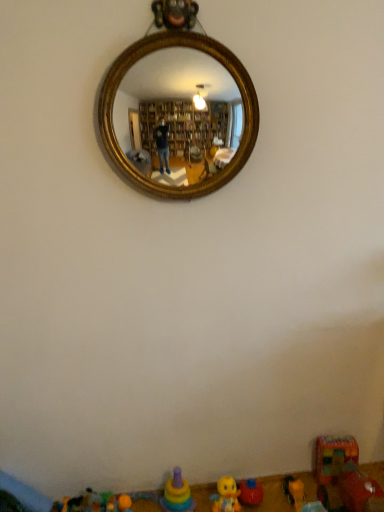
You are a GUI agent. You are given a task and a screenshot of the screen. Output one action in this format:
    pyautogui.click(x=<x>, y=<y>)
    Task: Click on the yellow plastic toy at lower right, which is the 6th toy from left to right
    
    Given the screenshot: What is the action you would take?
    pyautogui.click(x=294, y=490)

In order to face rubber duck at lower center, the seventh toy from the right, should I rotate leftwards or rightwards?

Turn left by 13.788 degrees to look at rubber duck at lower center, the seventh toy from the right.

Where is `yellow rubber duck at lower center, which is the fourth toy in right-to-left order`? The image size is (384, 512). yellow rubber duck at lower center, which is the fourth toy in right-to-left order is located at coordinates (226, 496).

What do you see at coordinates (177, 494) in the screenshot? This screenshot has width=384, height=512. I see `multicolored plastic stacking rings at lower center, acting as the 3th toy starting from the left` at bounding box center [177, 494].

Measure the distance between gold/gilded mirror at upper center and camera.

gold/gilded mirror at upper center and camera are 3.27 meters apart.

Find the location of a particular element. The width and height of the screenshot is (384, 512). yellow plastic toy at lower right, which is the 6th toy from left to right is located at coordinates (294, 490).

What are the coordinates of `toy that is the 1st one when counting rightward from the rubber duck at lower center, the seventh toy from the right` in the screenshot? It's located at (124, 503).

Based on the photo, are rubber duck at lower center, the 1th toy from the left, and orange rubber ball at lower center, the 6th toy in the right-to-left sequence, beside each other?

No, rubber duck at lower center, the 1th toy from the left, is not touching orange rubber ball at lower center, the 6th toy in the right-to-left sequence.

Which object is closer to the camera, rubber duck at lower center, the 1th toy from the left, or orange rubber ball at lower center, the 6th toy in the right-to-left sequence?

rubber duck at lower center, the 1th toy from the left, is in front.

Is rubber duck at lower center, the 1th toy from the left, outside of orange rubber ball at lower center, the 6th toy in the right-to-left sequence?

rubber duck at lower center, the 1th toy from the left, lies outside orange rubber ball at lower center, the 6th toy in the right-to-left sequence,'s area.

Is rubber duck at lower center, which is the third toy from right to left, situated inside rubber duck at lower center, the 1th toy from the left, or outside?

rubber duck at lower center, which is the third toy from right to left, is spatially situated outside rubber duck at lower center, the 1th toy from the left.

Which is in front, rubber duck at lower center, which is the third toy from right to left, or rubber duck at lower center, the seventh toy from the right?

Positioned in front is rubber duck at lower center, which is the third toy from right to left.

Does rubber duck at lower center, which is the third toy from right to left, have a greater height compared to rubber duck at lower center, the 1th toy from the left?

No, rubber duck at lower center, which is the third toy from right to left, is not taller than rubber duck at lower center, the 1th toy from the left.

This screenshot has height=512, width=384. In order to click on toy located on the left of orange rubber ball at lower center, the 2th toy in the left-to-right sequence in this screenshot , I will do `click(76, 503)`.

Is orange rubber ball at lower center, the 2th toy in the left-to-right sequence, positioned with its back to rubber duck at lower center, the 1th toy from the left?

No.

Is orange rubber ball at lower center, the 6th toy in the right-to-left sequence, not close to rubber duck at lower center, the 1th toy from the left?

No, there isn't a large distance between orange rubber ball at lower center, the 6th toy in the right-to-left sequence, and rubber duck at lower center, the 1th toy from the left.

From a real-world perspective, which is physically above, orange rubber ball at lower center, the 2th toy in the left-to-right sequence, or rubber duck at lower center, the seventh toy from the right?

orange rubber ball at lower center, the 2th toy in the left-to-right sequence.

Considering the relative positions of orange rubber ball at lower center, the 6th toy in the right-to-left sequence, and yellow plastic toy at lower right, which is the 6th toy from left to right, in the image provided, is orange rubber ball at lower center, the 6th toy in the right-to-left sequence, in front of yellow plastic toy at lower right, which is the 6th toy from left to right,?

No, the depth of orange rubber ball at lower center, the 6th toy in the right-to-left sequence, is greater than that of yellow plastic toy at lower right, which is the 6th toy from left to right.

Is orange rubber ball at lower center, the 2th toy in the left-to-right sequence, aimed at yellow plastic toy at lower right, which is the 6th toy from left to right?

No, orange rubber ball at lower center, the 2th toy in the left-to-right sequence, is not oriented towards yellow plastic toy at lower right, which is the 6th toy from left to right.

Is yellow plastic toy at lower right, which is the 6th toy from left to right, located within orange rubber ball at lower center, the 2th toy in the left-to-right sequence?

No, yellow plastic toy at lower right, which is the 6th toy from left to right, is not a part of orange rubber ball at lower center, the 2th toy in the left-to-right sequence.

Are orange rubber ball at lower center, the 6th toy in the right-to-left sequence, and yellow plastic toy at lower right, which is the 6th toy from left to right, far apart?

orange rubber ball at lower center, the 6th toy in the right-to-left sequence, is actually quite close to yellow plastic toy at lower right, which is the 6th toy from left to right.

Could yellow rubber duck at lower center, which is the fourth toy in right-to-left order, be considered to be inside multicolored plastic stacking rings at lower center, acting as the 5th toy starting from the right?

No, yellow rubber duck at lower center, which is the fourth toy in right-to-left order, is located outside of multicolored plastic stacking rings at lower center, acting as the 5th toy starting from the right.

Can you confirm if multicolored plastic stacking rings at lower center, acting as the 3th toy starting from the left, is thinner than yellow rubber duck at lower center, which is the fourth toy in right-to-left order?

Incorrect, the width of multicolored plastic stacking rings at lower center, acting as the 3th toy starting from the left, is not less than that of yellow rubber duck at lower center, which is the fourth toy in right-to-left order.

Between multicolored plastic stacking rings at lower center, acting as the 3th toy starting from the left, and yellow rubber duck at lower center, the 4th toy viewed from the left, which one appears on the right side from the viewer's perspective?

yellow rubber duck at lower center, the 4th toy viewed from the left.

Does multicolored plastic stacking rings at lower center, acting as the 3th toy starting from the left, have a larger size compared to yellow rubber duck at lower center, which is the fourth toy in right-to-left order?

Correct, multicolored plastic stacking rings at lower center, acting as the 3th toy starting from the left, is larger in size than yellow rubber duck at lower center, which is the fourth toy in right-to-left order.

From a real-world perspective, is orange rubber ball at lower center, the 6th toy in the right-to-left sequence, beneath plastic multicolored car at lower right, which is the first toy from right to left?

Yes, from a real-world perspective, orange rubber ball at lower center, the 6th toy in the right-to-left sequence, is beneath plastic multicolored car at lower right, which is the first toy from right to left.

Is orange rubber ball at lower center, the 2th toy in the left-to-right sequence, spatially inside plastic multicolored car at lower right, which appears as the seventh toy when viewed from the left, or outside of it?

orange rubber ball at lower center, the 2th toy in the left-to-right sequence, is not inside plastic multicolored car at lower right, which appears as the seventh toy when viewed from the left, it's outside.

Between orange rubber ball at lower center, the 6th toy in the right-to-left sequence, and plastic multicolored car at lower right, which is the first toy from right to left, which one has larger width?

plastic multicolored car at lower right, which is the first toy from right to left.

Is orange rubber ball at lower center, the 2th toy in the left-to-right sequence, far away from plastic multicolored car at lower right, which is the first toy from right to left?

No, orange rubber ball at lower center, the 2th toy in the left-to-right sequence, is not far from plastic multicolored car at lower right, which is the first toy from right to left.

Find the location of a particular element. The image size is (384, 512). toy that is the 6th one when counting downward from the gold/gilded mirror at upper center (from the image's perspective) is located at coordinates (352, 476).

Is point (231, 117) closer to camera compared to point (192, 503)?

No, it is not.

Choose the correct answer: Is gold/gilded mirror at upper center inside rubber duck at lower center, the fifth toy viewed from the left, or outside it?

The correct answer is: outside.

Is the position of gold/gilded mirror at upper center more distant than that of rubber duck at lower center, the fifth toy viewed from the left?

No, gold/gilded mirror at upper center is in front of rubber duck at lower center, the fifth toy viewed from the left.

Locate an element on the screen. The height and width of the screenshot is (512, 384). the 1st toy to the right of the rubber duck at lower center, the seventh toy from the right, counting from the anchor's position is located at coordinates (124, 503).

I want to click on the 4th toy to the left of the rubber duck at lower center, which is the third toy from right to left, starting your count from the anchor, so click(76, 503).

When comparing their distances from multicolored plastic stacking rings at lower center, acting as the 5th toy starting from the right, does gold/gilded mirror at upper center or rubber duck at lower center, the fifth toy viewed from the left, seem further?

gold/gilded mirror at upper center is positioned further to the anchor multicolored plastic stacking rings at lower center, acting as the 5th toy starting from the right.

Estimate the real-world distances between objects in this image. Which object is closer to rubber duck at lower center, the fifth toy viewed from the left, yellow rubber duck at lower center, which is the fourth toy in right-to-left order, or gold/gilded mirror at upper center?

Based on the image, yellow rubber duck at lower center, which is the fourth toy in right-to-left order, appears to be nearer to rubber duck at lower center, the fifth toy viewed from the left.

Considering their positions, is rubber duck at lower center, the 1th toy from the left, positioned further to yellow rubber duck at lower center, the 4th toy viewed from the left, than orange rubber ball at lower center, the 6th toy in the right-to-left sequence?

Based on the image, rubber duck at lower center, the 1th toy from the left, appears to be further to yellow rubber duck at lower center, the 4th toy viewed from the left.

When comparing their distances from orange rubber ball at lower center, the 6th toy in the right-to-left sequence, does multicolored plastic stacking rings at lower center, acting as the 5th toy starting from the right, or rubber duck at lower center, the fifth toy viewed from the left, seem further?

Among the two, rubber duck at lower center, the fifth toy viewed from the left, is located further to orange rubber ball at lower center, the 6th toy in the right-to-left sequence.

Estimate the real-world distances between objects in this image. Which object is further from plastic multicolored car at lower right, which is the first toy from right to left, yellow plastic toy at lower right, which is counted as the second toy, starting from the right, or rubber duck at lower center, the 1th toy from the left?

rubber duck at lower center, the 1th toy from the left, is positioned further to the anchor plastic multicolored car at lower right, which is the first toy from right to left.

When comparing their distances from rubber duck at lower center, which is the third toy from right to left, does multicolored plastic stacking rings at lower center, acting as the 5th toy starting from the right, or orange rubber ball at lower center, the 6th toy in the right-to-left sequence, seem closer?

Based on the image, multicolored plastic stacking rings at lower center, acting as the 5th toy starting from the right, appears to be nearer to rubber duck at lower center, which is the third toy from right to left.

Considering their positions, is plastic multicolored car at lower right, which appears as the seventh toy when viewed from the left, positioned further to yellow rubber duck at lower center, the 4th toy viewed from the left, than orange rubber ball at lower center, the 6th toy in the right-to-left sequence?

plastic multicolored car at lower right, which appears as the seventh toy when viewed from the left, is positioned further to the anchor yellow rubber duck at lower center, the 4th toy viewed from the left.

Looking at the image, which one is located closer to yellow rubber duck at lower center, the 4th toy viewed from the left, yellow plastic toy at lower right, which is the 6th toy from left to right, or rubber duck at lower center, the seventh toy from the right?

yellow plastic toy at lower right, which is the 6th toy from left to right, lies closer to yellow rubber duck at lower center, the 4th toy viewed from the left, than the other object.

Where is `toy between gold/gilded mirror at upper center and multicolored plastic stacking rings at lower center, acting as the 3th toy starting from the left, in the up-down direction`? The height and width of the screenshot is (512, 384). toy between gold/gilded mirror at upper center and multicolored plastic stacking rings at lower center, acting as the 3th toy starting from the left, in the up-down direction is located at coordinates (344, 473).

Image resolution: width=384 pixels, height=512 pixels. I want to click on toy between multicolored plastic stacking rings at lower center, acting as the 5th toy starting from the right, and rubber duck at lower center, the fifth toy viewed from the left, in the horizontal direction, so click(x=226, y=496).

Identify the location of toy between yellow rubber duck at lower center, which is the fourth toy in right-to-left order, and yellow plastic toy at lower right, which is counted as the second toy, starting from the right, in the horizontal direction. (352, 476).

Image resolution: width=384 pixels, height=512 pixels. In order to click on toy between orange rubber ball at lower center, the 2th toy in the left-to-right sequence, and yellow rubber duck at lower center, the 4th toy viewed from the left, from left to right in this screenshot , I will do `click(177, 494)`.